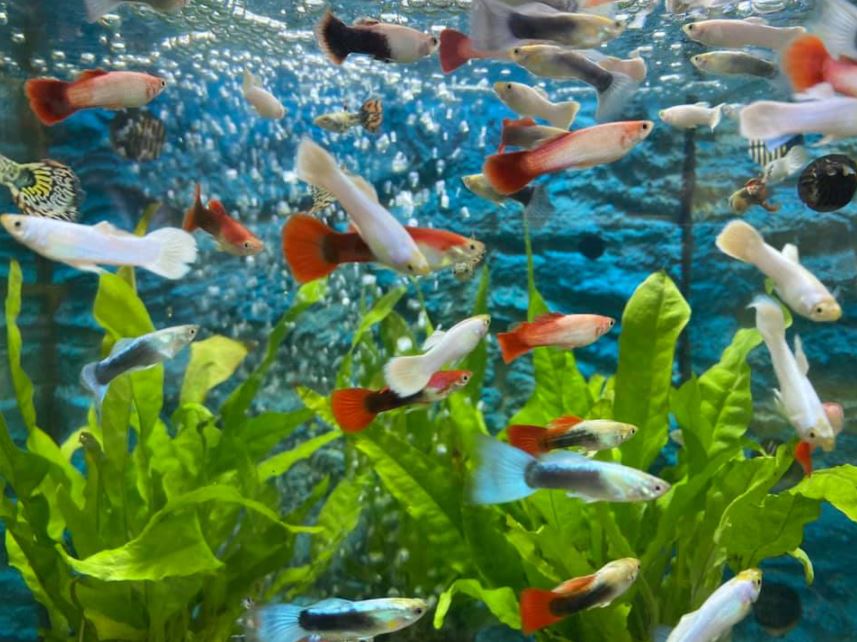
Find the location of a particular element. This screenshot has width=857, height=642. plant is located at coordinates (663, 544).